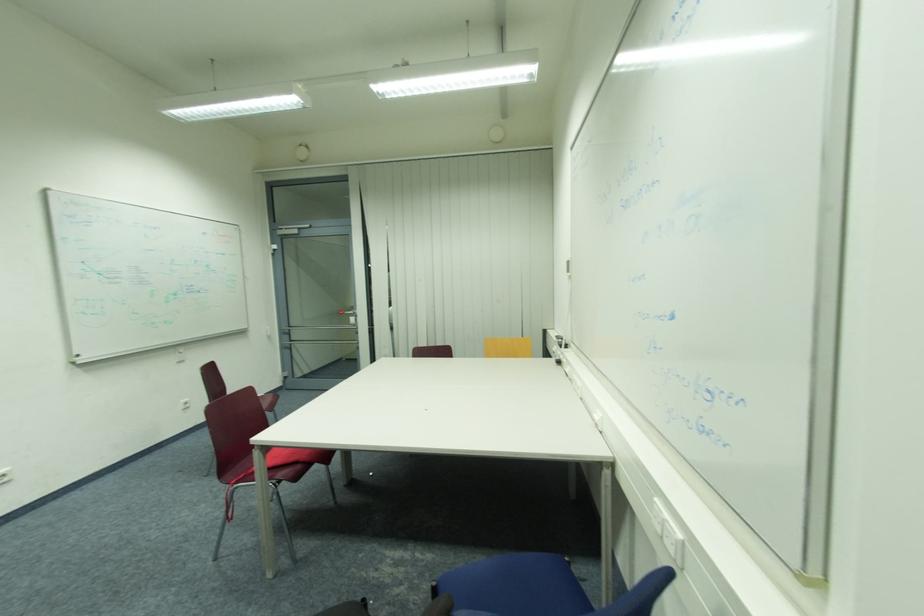
Find where to pull the metal door handle. Please return your answer as a coordinate pair (x, y).

(345, 318)